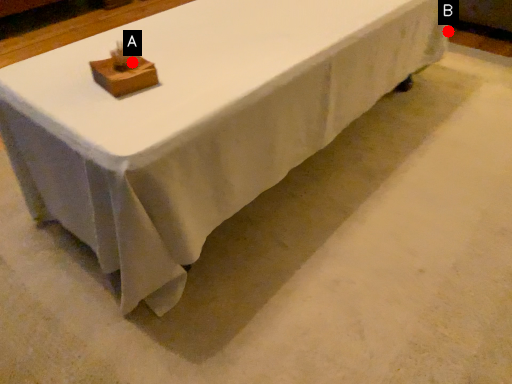
Question: Two points are circled on the image, labeled by A and B beside each circle. Which point appears closest to the camera in this image?

Choices:
 (A) A is closer
 (B) B is closer

Answer: (A)